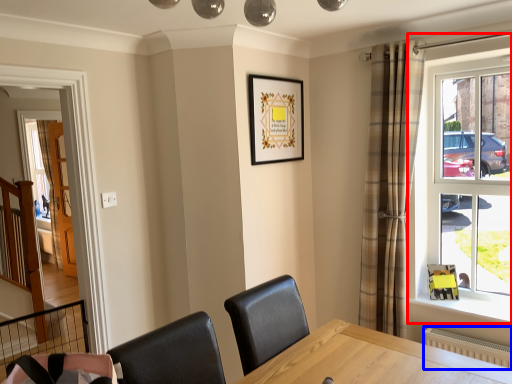
Question: Which of the following is the farthest to the observer, window (highlighted by a red box) or radiator (highlighted by a blue box)?

Choices:
 (A) window
 (B) radiator

Answer: (A)